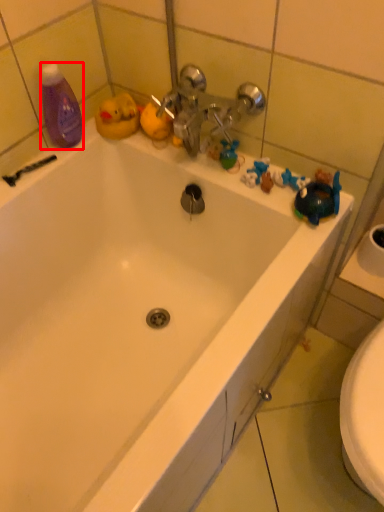
Question: From the image's perspective, considering the relative positions of cleaning product (annotated by the red box) and shower in the image provided, where is cleaning product (annotated by the red box) located with respect to the staircase?

Choices:
 (A) below
 (B) above

Answer: (B)